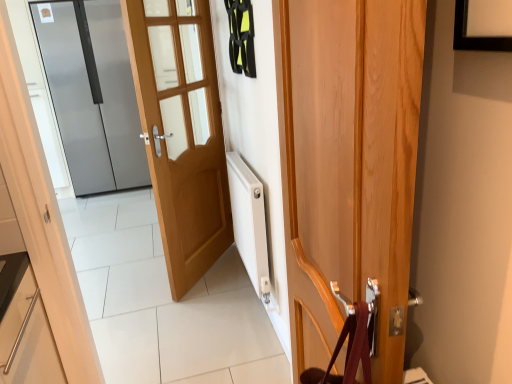
Question: Is wooden door at center, acting as the first door starting from the right, shorter than light brown wood door at center, positioned as the 2th door in back-to-front order?

Choices:
 (A) no
 (B) yes

Answer: (B)

Question: From a real-world perspective, does wooden door at center, acting as the first door starting from the right, sit lower than light brown wood door at center, the 2th door viewed from the right?

Choices:
 (A) yes
 (B) no

Answer: (A)

Question: Is wooden door at center, which is counted as the third door, starting from the back, positioned far away from light brown wood door at center, the 2th door viewed from the right?

Choices:
 (A) no
 (B) yes

Answer: (B)

Question: Is light brown wood door at center, the 2th door viewed from the right, at the back of wooden door at center, which is counted as the third door, starting from the back?

Choices:
 (A) yes
 (B) no

Answer: (B)

Question: Could you tell me if wooden door at center, which is counted as the third door, starting from the back, is turned towards light brown wood door at center, positioned as the 2th door in back-to-front order?

Choices:
 (A) no
 (B) yes

Answer: (A)

Question: Is wooden door at center, the 3th door viewed from the left, bigger than light brown wood door at center, which is counted as the 2th door, starting from the front?

Choices:
 (A) yes
 (B) no

Answer: (A)

Question: Is satin silver refrigerator at left, which is the first door from left to right, facing towards light brown wood door at center, positioned as the 2th door in back-to-front order?

Choices:
 (A) no
 (B) yes

Answer: (B)

Question: Is satin silver refrigerator at left, which is the first door from left to right, touching light brown wood door at center, positioned as the 2th door in back-to-front order?

Choices:
 (A) no
 (B) yes

Answer: (A)

Question: Can you confirm if satin silver refrigerator at left, acting as the 3th door starting from the front, is wider than light brown wood door at center, which ranks as the 2th door in left-to-right order?

Choices:
 (A) no
 (B) yes

Answer: (B)

Question: Does satin silver refrigerator at left, the third door from the right, lie in front of light brown wood door at center, which ranks as the 2th door in left-to-right order?

Choices:
 (A) yes
 (B) no

Answer: (B)

Question: Can you confirm if satin silver refrigerator at left, acting as the 3th door starting from the front, is bigger than light brown wood door at center, which ranks as the 2th door in left-to-right order?

Choices:
 (A) yes
 (B) no

Answer: (A)

Question: From the image's perspective, is satin silver refrigerator at left, the third door from the right, under light brown wood door at center, positioned as the 2th door in back-to-front order?

Choices:
 (A) yes
 (B) no

Answer: (B)

Question: Does light brown wood door at center, the 2th door viewed from the right, turn towards satin silver refrigerator at left, which is the first door from left to right?

Choices:
 (A) yes
 (B) no

Answer: (B)